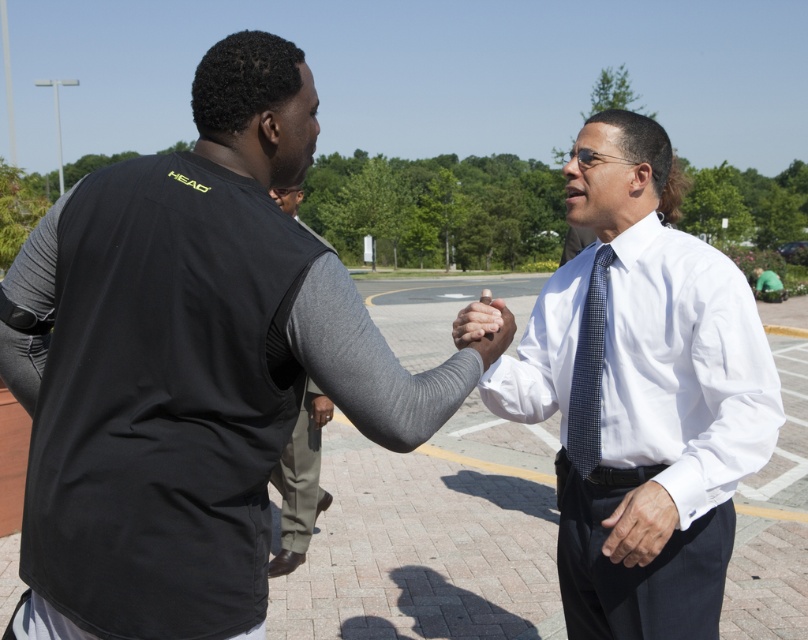
You are a photographer capturing the scene of two people shaking hands. You need to ensure that the white shirt at center and the gray fabric sleeve at center are both clearly visible in the photo. Based on their positions, which one should you focus on to ensure both are in focus?

The white shirt at center is in front of the gray fabric sleeve at center. To ensure both are in focus, focus on the white shirt at center since it is closer to the camera.

From the picture: You are a photographer standing at the point marked as point (642, 429). You want to capture a photo of both individuals in the handshake scene. Based on their current distance, will you need to zoom in or out to ensure both are fully visible in the frame?

The individuals are 1.86 meters apart. To ensure both are fully visible in the frame, you would need to zoom out slightly to accommodate their distance from each other.